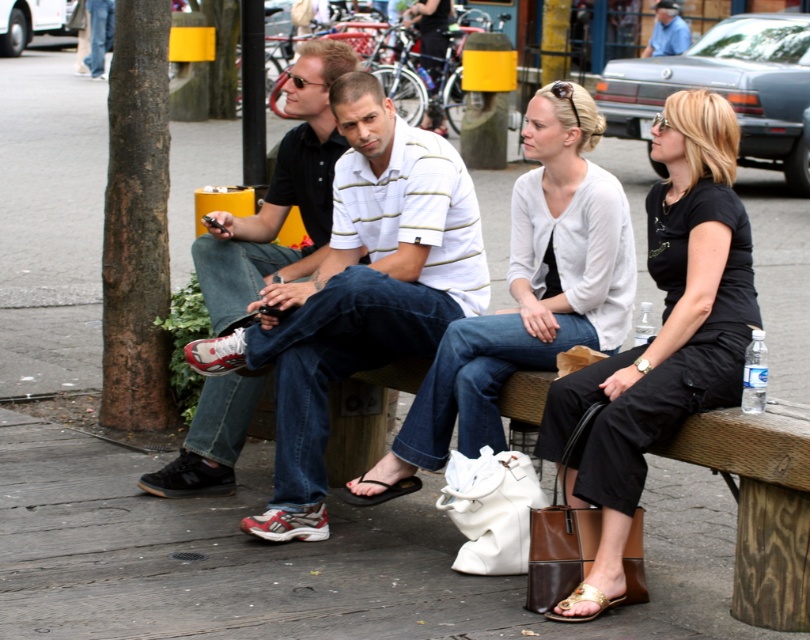
Can you confirm if matte white sweater at center is positioned to the left of black rubber sandal at lower center?

No, matte white sweater at center is not to the left of black rubber sandal at lower center.

In the scene shown: Who is more forward, [359,493] or [369,499]?

Point [359,493] is more forward.

Identify the location of matte white sweater at center. (531, 289).

Is brown woven bench at lower center below black rubber sandal at lower center?

Correct, brown woven bench at lower center is located below black rubber sandal at lower center.

Does brown woven bench at lower center lie in front of black rubber sandal at lower center?

Yes.

Does point (506, 417) lie in front of point (373, 502)?

Yes, point (506, 417) is in front of point (373, 502).

At what (x,y) coordinates should I click in order to perform the action: click on brown woven bench at lower center. Please return your answer as a coordinate pair (x, y). Looking at the image, I should click on (761, 504).

Does white striped polo shirt at center appear over gold metallic sandal at lower center?

Indeed, white striped polo shirt at center is positioned over gold metallic sandal at lower center.

Is point (357, 116) farther from camera compared to point (578, 586)?

Yes, it is behind point (578, 586).

Find the location of a particular element. The image size is (810, 640). white striped polo shirt at center is located at coordinates (364, 289).